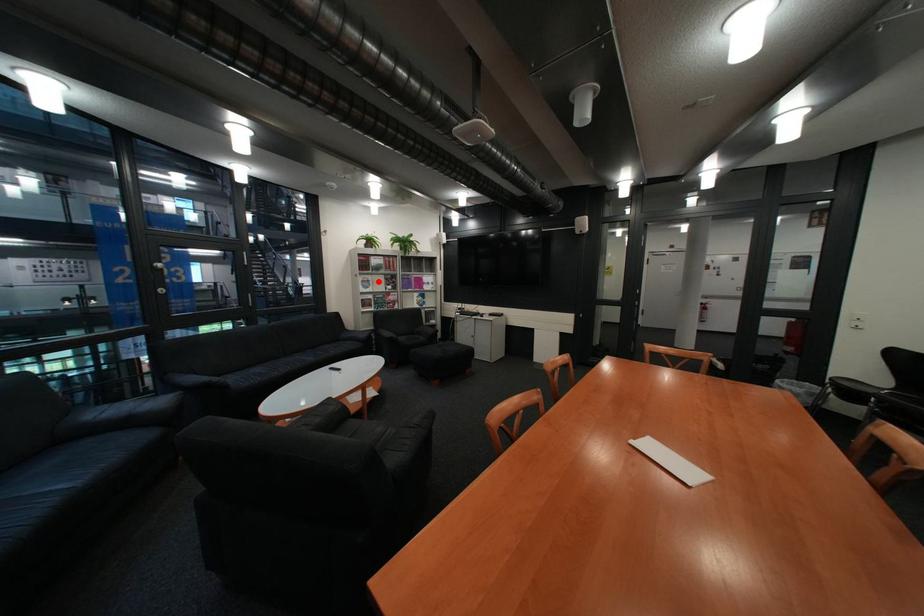
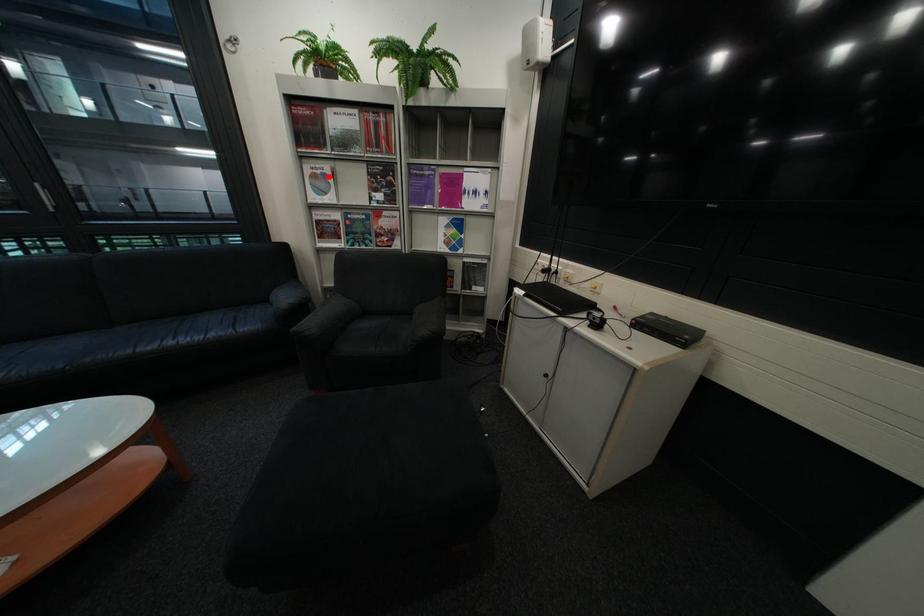
I am providing you with two images of the same scene from different viewpoints. A red point is marked on the first image and another point is marked on the second image. Are the points marked in image1 and image2 representing the same 3D position?

Yes